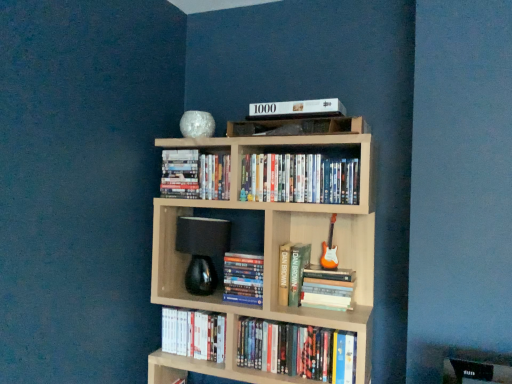
Measure the distance between point [307,366] and camera.

The depth of point [307,366] is 1.64 meters.

The height and width of the screenshot is (384, 512). Describe the element at coordinates (297, 108) in the screenshot. I see `white matte book at upper center, which is counted as the first book, starting from the top` at that location.

What do you see at coordinates (297, 271) in the screenshot? This screenshot has height=384, width=512. I see `hardcover book at center, positioned as the fifth book in bottom-to-top order` at bounding box center [297, 271].

The width and height of the screenshot is (512, 384). Describe the element at coordinates (328, 289) in the screenshot. I see `hardcover book at center, the sixth book positioned from the top` at that location.

Where is `hardcover books at lower center, marked as the first book in a bottom-to-top arrangement`? hardcover books at lower center, marked as the first book in a bottom-to-top arrangement is located at coordinates (297, 350).

Which is nearer, (290, 259) or (244, 275)?

Point (290, 259).

Is hardcover book at center, the 4th book positioned from the top, oriented away from hardcover book at center, acting as the fifth book starting from the top?

No, hardcover book at center, the 4th book positioned from the top, is not facing away from hardcover book at center, acting as the fifth book starting from the top.

Can you confirm if hardcover book at center, positioned as the fifth book in bottom-to-top order, is taller than hardcover book at center, acting as the fifth book starting from the top?

Yes, hardcover book at center, positioned as the fifth book in bottom-to-top order, is taller than hardcover book at center, acting as the fifth book starting from the top.

From a real-world perspective, which object stands above the other?

hardcover book at center, positioned as the fifth book in bottom-to-top order, from a real-world perspective.

What are the coordinates of `the 1st book to the left when counting from the light wood bookcase at center` in the screenshot? It's located at (243, 278).

Looking at this image, does light wood bookcase at center contain hardcover book at center, which ranks as the 4th book in bottom-to-top order?

Answer: Yes, light wood bookcase at center is surrounding hardcover book at center, which ranks as the 4th book in bottom-to-top order.

Is light wood bookcase at center directly adjacent to hardcover book at center, which ranks as the 4th book in bottom-to-top order?

No, light wood bookcase at center is not next to hardcover book at center, which ranks as the 4th book in bottom-to-top order.

Identify the location of the 4th book below the matte plastic dvds at upper center, which ranks as the 6th book in bottom-to-top order (from the image's perspective). (194, 334).

From a real-world perspective, relative to matte white dvd at lower center, which is counted as the seventh book, starting from the top, is matte plastic dvds at upper center, arranged as the 3th book when viewed from the top, vertically above or below?

matte plastic dvds at upper center, arranged as the 3th book when viewed from the top, is above matte white dvd at lower center, which is counted as the seventh book, starting from the top.

From the image's perspective, who appears lower, matte plastic dvds at upper center, which ranks as the 6th book in bottom-to-top order, or matte white dvd at lower center, which is counted as the seventh book, starting from the top?

matte white dvd at lower center, which is counted as the seventh book, starting from the top, is shown below in the image.

Between matte plastic dvds at upper center, which ranks as the 6th book in bottom-to-top order, and matte white dvd at lower center, which is counted as the seventh book, starting from the top, which one has larger size?

Bigger between the two is matte plastic dvds at upper center, which ranks as the 6th book in bottom-to-top order.

How many degrees apart are the facing directions of matte white dvd at lower center, which is the 2th book from bottom to top, and matte plastic dvds at upper center, arranged as the 3th book when viewed from the top?

0.000885 degrees.

Does matte white dvd at lower center, which is the 2th book from bottom to top, appear on the left side of matte plastic dvds at upper center, which ranks as the 6th book in bottom-to-top order?

Yes.

Is matte white dvd at lower center, which is counted as the seventh book, starting from the top, located outside matte plastic dvds at upper center, arranged as the 3th book when viewed from the top?

Yes.

How distant is matte white dvd at lower center, which is the 2th book from bottom to top, from matte plastic dvds at upper center, arranged as the 3th book when viewed from the top?

matte white dvd at lower center, which is the 2th book from bottom to top, is 25.34 inches away from matte plastic dvds at upper center, arranged as the 3th book when viewed from the top.

Can you confirm if hardcover book at center, which ranks as the 4th book in bottom-to-top order, is positioned to the right of black glass lamp at center?

Yes, hardcover book at center, which ranks as the 4th book in bottom-to-top order, is to the right of black glass lamp at center.

Is point (254, 275) less distant than point (193, 218)?

Yes, it is.

The height and width of the screenshot is (384, 512). In order to click on lamp on the left of the hardcover book at center, which ranks as the 4th book in bottom-to-top order in this screenshot , I will do `click(202, 250)`.

From the image's perspective, which one is positioned higher, hardcover book at upper center, positioned as the 2th book in top-to-bottom order, or hardcover book at center, which is the third book from bottom to top?

hardcover book at upper center, positioned as the 2th book in top-to-bottom order, from the image's perspective.

Is hardcover book at center, which is the third book from bottom to top, inside hardcover book at upper center, positioned as the 2th book in top-to-bottom order?

No, hardcover book at center, which is the third book from bottom to top, is not inside hardcover book at upper center, positioned as the 2th book in top-to-bottom order.

Is point (163, 183) positioned after point (316, 305)?

That is True.

Does hardcover book at upper center, positioned as the 2th book in top-to-bottom order, have a lesser height compared to hardcover book at center, the sixth book positioned from the top?

No, hardcover book at upper center, positioned as the 2th book in top-to-bottom order, is not shorter than hardcover book at center, the sixth book positioned from the top.

Who is more distant, hardcover books at lower center, marked as the eighth book in a top-to-bottom arrangement, or hardcover book at center, the 4th book positioned from the top?

hardcover book at center, the 4th book positioned from the top, is more distant.

Is hardcover books at lower center, marked as the eighth book in a top-to-bottom arrangement, taller than hardcover book at center, positioned as the fifth book in bottom-to-top order?

In fact, hardcover books at lower center, marked as the eighth book in a top-to-bottom arrangement, may be shorter than hardcover book at center, positioned as the fifth book in bottom-to-top order.

Based on the photo, between hardcover books at lower center, marked as the eighth book in a top-to-bottom arrangement, and hardcover book at center, the 4th book positioned from the top, which one has smaller width?

With smaller width is hardcover books at lower center, marked as the eighth book in a top-to-bottom arrangement.

Do you think hardcover books at lower center, marked as the first book in a bottom-to-top arrangement, is within hardcover book at center, positioned as the fifth book in bottom-to-top order, or outside of it?

hardcover books at lower center, marked as the first book in a bottom-to-top arrangement, is not enclosed by hardcover book at center, positioned as the fifth book in bottom-to-top order.

Where is `the 1st book positioned above the hardcover book at center, which ranks as the 4th book in bottom-to-top order (from the image's perspective)`? the 1st book positioned above the hardcover book at center, which ranks as the 4th book in bottom-to-top order (from the image's perspective) is located at coordinates (297, 271).

This screenshot has width=512, height=384. Find the location of `book that is the 1st one when counting leftward from the light wood bookcase at center`. book that is the 1st one when counting leftward from the light wood bookcase at center is located at coordinates coord(243,278).

From the picture: Considering their positions, is hardcover book at center, which is the third book from bottom to top, positioned further to white matte book at upper center, which is counted as the first book, starting from the top, than hardcover books at lower center, marked as the eighth book in a top-to-bottom arrangement?

hardcover books at lower center, marked as the eighth book in a top-to-bottom arrangement, lies further to white matte book at upper center, which is counted as the first book, starting from the top, than the other object.

When comparing their distances from hardcover books at lower center, marked as the eighth book in a top-to-bottom arrangement, does hardcover book at upper center, arranged as the 7th book when ordered from the bottom, or hardcover book at center, positioned as the fifth book in bottom-to-top order, seem further?

The object further to hardcover books at lower center, marked as the eighth book in a top-to-bottom arrangement, is hardcover book at upper center, arranged as the 7th book when ordered from the bottom.

Based on their spatial positions, is white matte book at upper center, which is counted as the first book, starting from the top, or hardcover book at center, which ranks as the 4th book in bottom-to-top order, closer to hardcover book at upper center, arranged as the 7th book when ordered from the bottom?

Among the two, white matte book at upper center, which is counted as the first book, starting from the top, is located nearer to hardcover book at upper center, arranged as the 7th book when ordered from the bottom.

Considering their positions, is black glass lamp at center positioned further to light wood bookcase at center than matte plastic dvds at upper center, which ranks as the 6th book in bottom-to-top order?

black glass lamp at center.

From the picture: Which object lies further to the anchor point hardcover book at center, the 4th book positioned from the top, matte plastic dvds at upper center, arranged as the 3th book when viewed from the top, or white matte book at upper center, which is counted as the first book, starting from the top?

Among the two, white matte book at upper center, which is counted as the first book, starting from the top, is located further to hardcover book at center, the 4th book positioned from the top.

Considering their positions, is hardcover books at lower center, marked as the eighth book in a top-to-bottom arrangement, positioned closer to black glass lamp at center than matte white dvd at lower center, which is counted as the seventh book, starting from the top?

Based on the image, matte white dvd at lower center, which is counted as the seventh book, starting from the top, appears to be nearer to black glass lamp at center.

Looking at the image, which one is located further to white matte book at upper center, the eighth book ordered from the bottom, hardcover book at upper center, arranged as the 7th book when ordered from the bottom, or hardcover books at lower center, marked as the first book in a bottom-to-top arrangement?

hardcover books at lower center, marked as the first book in a bottom-to-top arrangement, is positioned further to the anchor white matte book at upper center, the eighth book ordered from the bottom.

From the image, which object appears to be farther from matte white dvd at lower center, which is counted as the seventh book, starting from the top, white matte book at upper center, the eighth book ordered from the bottom, or hardcover book at center, positioned as the fifth book in bottom-to-top order?

white matte book at upper center, the eighth book ordered from the bottom, is positioned further to the anchor matte white dvd at lower center, which is counted as the seventh book, starting from the top.

Where is `bookcase between matte white dvd at lower center, which is counted as the seventh book, starting from the top, and hardcover books at lower center, marked as the first book in a bottom-to-top arrangement, in the horizontal direction`? Image resolution: width=512 pixels, height=384 pixels. bookcase between matte white dvd at lower center, which is counted as the seventh book, starting from the top, and hardcover books at lower center, marked as the first book in a bottom-to-top arrangement, in the horizontal direction is located at coordinates (271, 249).

Find the location of `bookcase between white matte book at upper center, which is counted as the first book, starting from the top, and hardcover books at lower center, marked as the first book in a bottom-to-top arrangement, from top to bottom`. bookcase between white matte book at upper center, which is counted as the first book, starting from the top, and hardcover books at lower center, marked as the first book in a bottom-to-top arrangement, from top to bottom is located at coordinates (271, 249).

Where is `bookcase that lies between white matte book at upper center, the eighth book ordered from the bottom, and matte white dvd at lower center, which is counted as the seventh book, starting from the top, from top to bottom`? bookcase that lies between white matte book at upper center, the eighth book ordered from the bottom, and matte white dvd at lower center, which is counted as the seventh book, starting from the top, from top to bottom is located at coordinates point(271,249).

The height and width of the screenshot is (384, 512). In order to click on bookcase between black glass lamp at center and hardcover books at lower center, marked as the first book in a bottom-to-top arrangement, in the horizontal direction in this screenshot , I will do `click(271, 249)`.